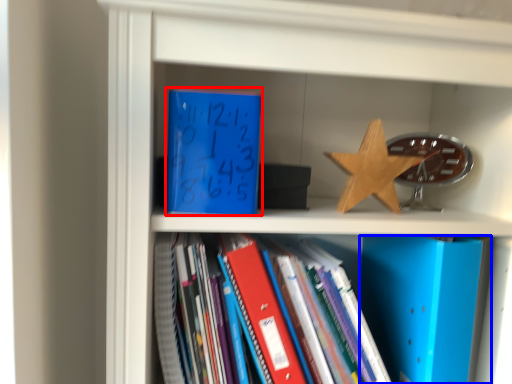
Question: Among these objects, which one is nearest to the camera, paperback book (highlighted by a red box) or paperback book (highlighted by a blue box)?

Choices:
 (A) paperback book
 (B) paperback book

Answer: (A)